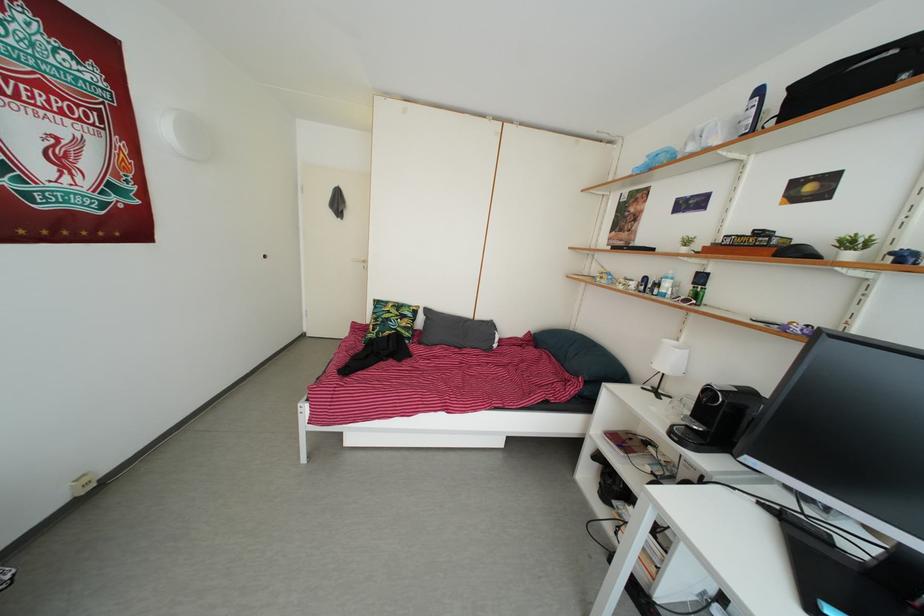
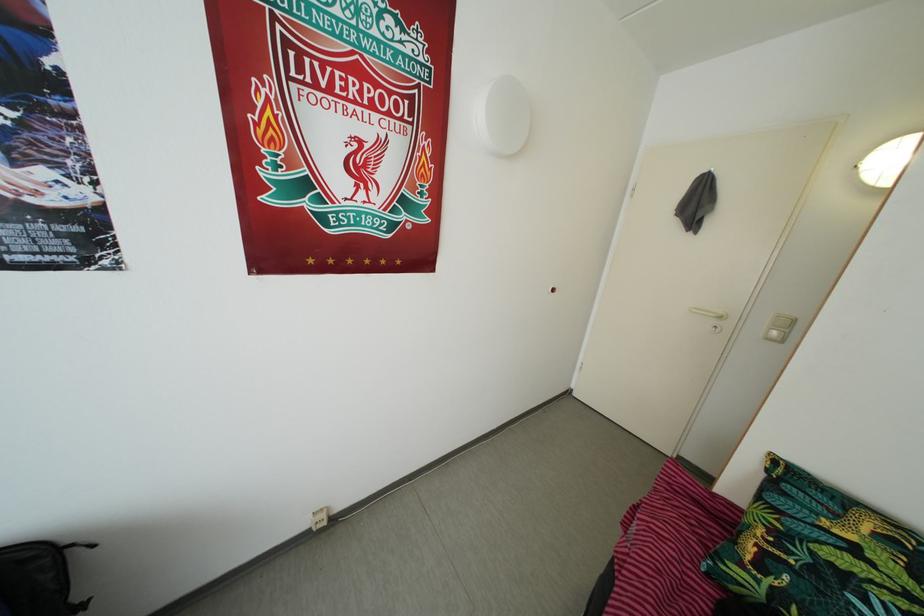
The point at (345,212) is marked in the first image. Where is the corresponding point in the second image?

(703, 213)